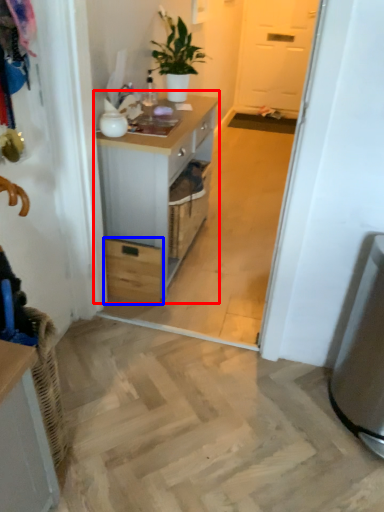
Question: Which point is closer to the camera, chest of drawers (highlighted by a red box) or drawer (highlighted by a blue box)?

Choices:
 (A) chest of drawers
 (B) drawer

Answer: (A)